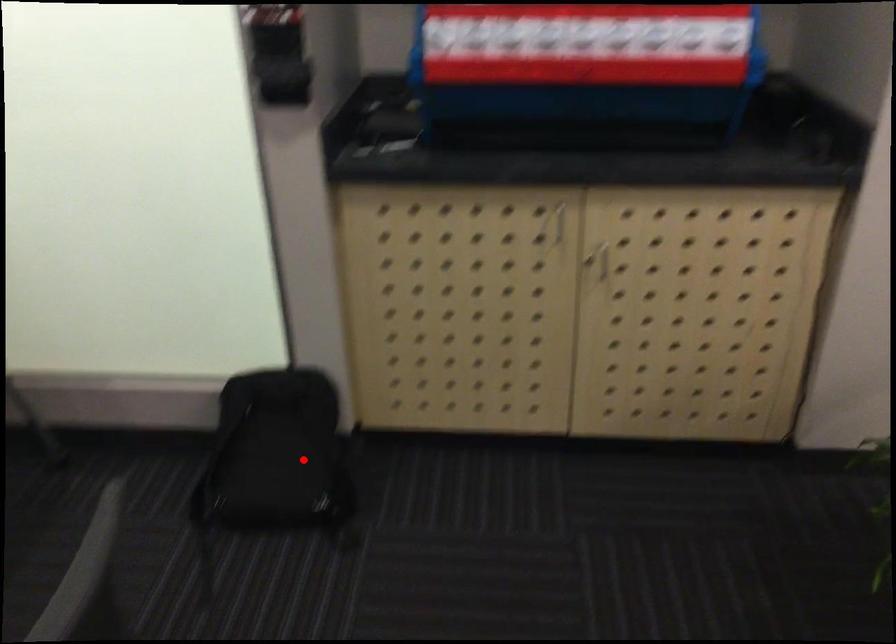
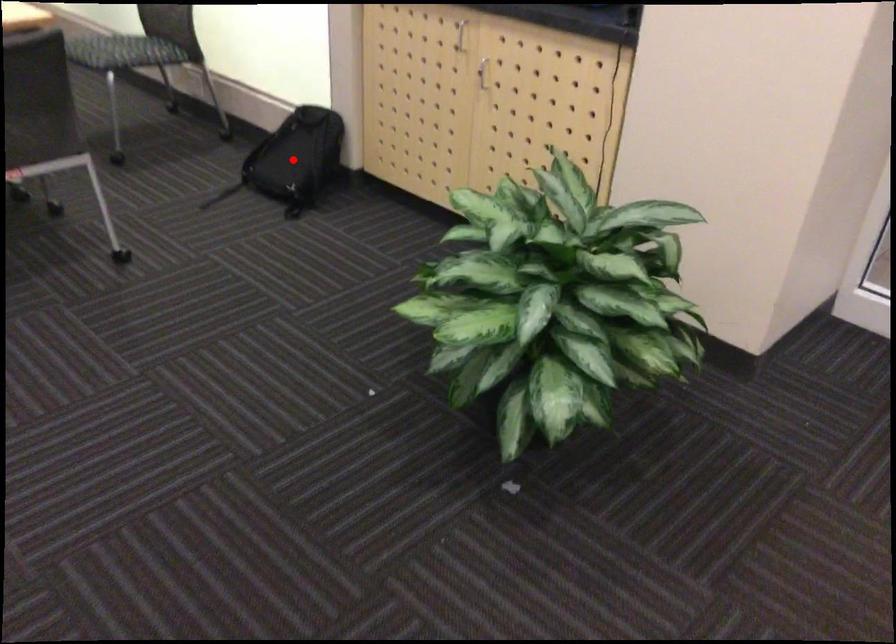
I am providing you with two images of the same scene from different viewpoints. A red point is marked on the first image and another point is marked on the second image. Does the point marked in image1 correspond to the same location as the one in image2?

Yes